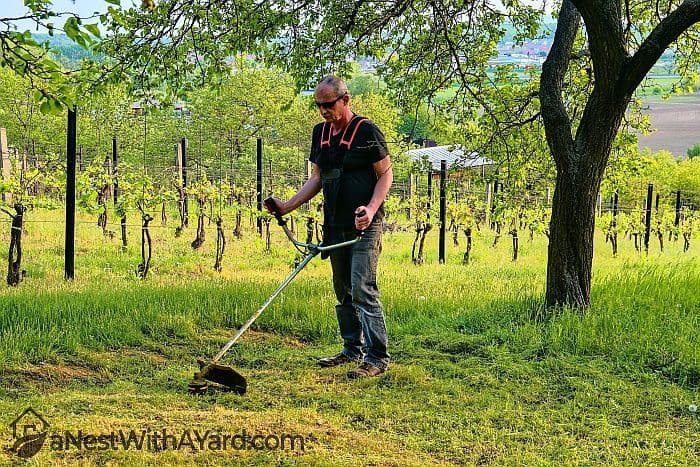
This screenshot has height=467, width=700. Identify the location of handles. (283, 224), (355, 237).